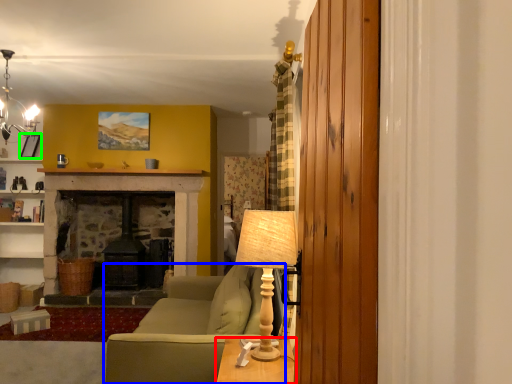
Question: Which object is the closest to the table (highlighted by a red box)? Choose among these: studio couch (highlighted by a blue box) or picture frame (highlighted by a green box).

Choices:
 (A) studio couch
 (B) picture frame

Answer: (A)